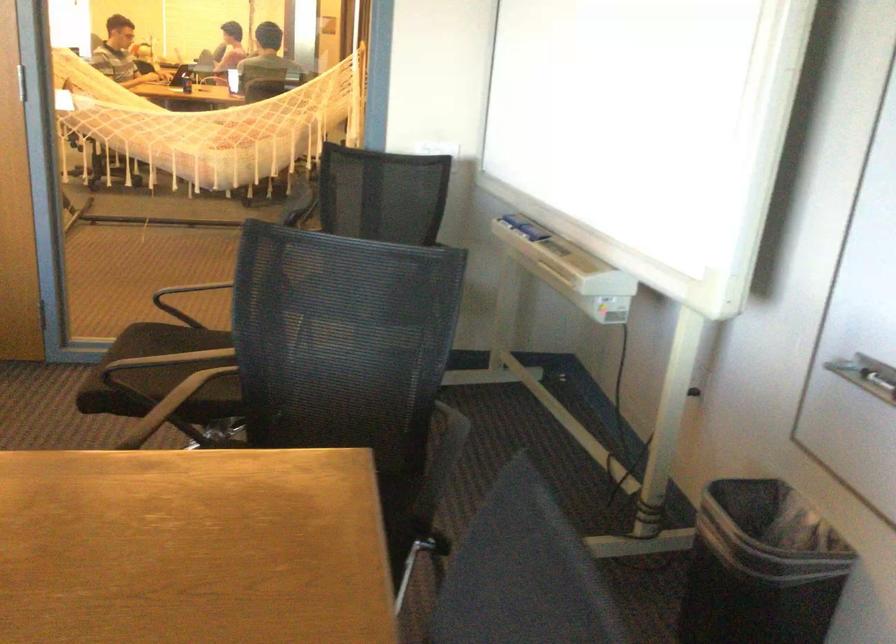
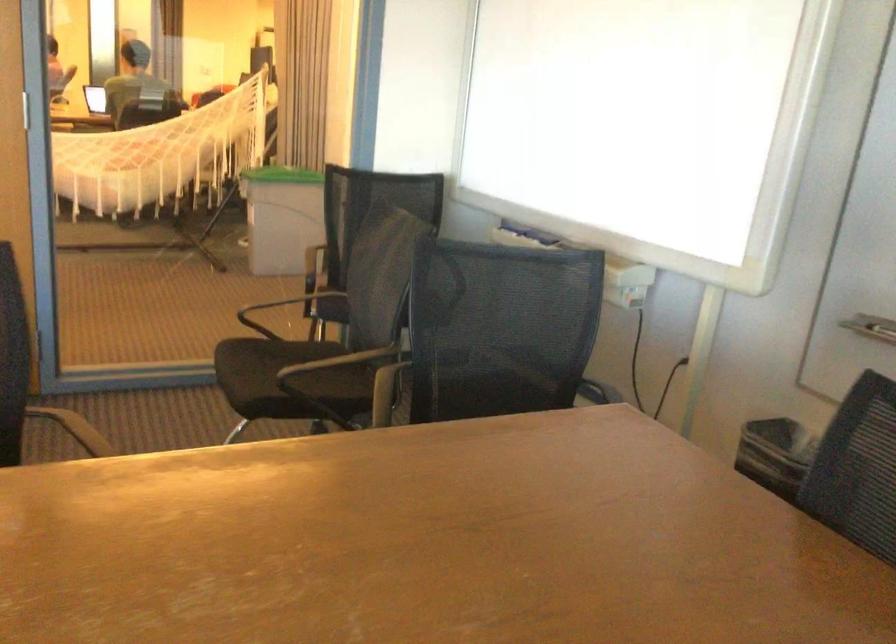
Where in the second image is the point corresponding to point (349, 339) from the first image?

(501, 328)